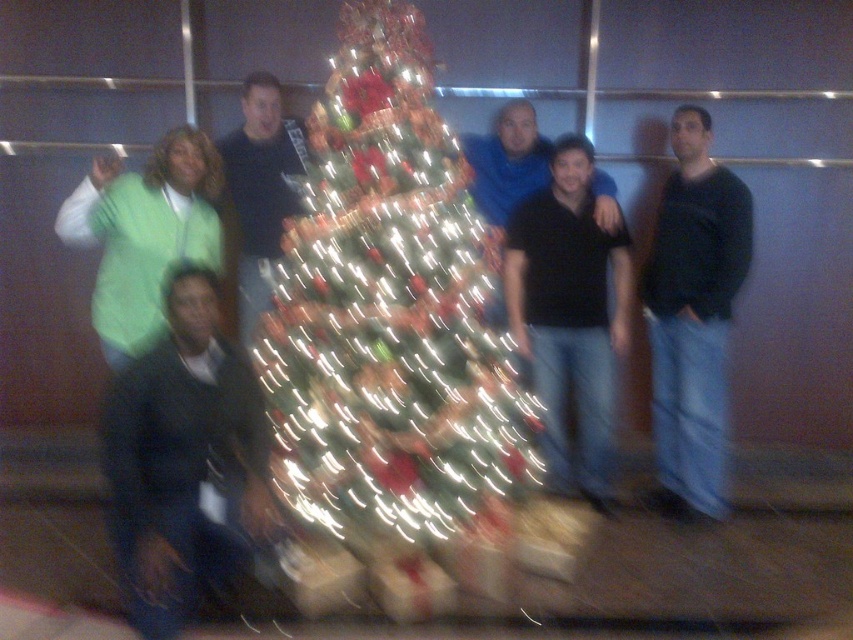
Question: Does dark blue jacket at lower left appear on the left side of green fleece at left?

Choices:
 (A) no
 (B) yes

Answer: (A)

Question: Which of the following is the closest to the observer?

Choices:
 (A) (366, 92)
 (B) (192, 193)

Answer: (A)

Question: Which object is farther from the camera taking this photo?

Choices:
 (A) black matte shirt at center
 (B) dark blue jacket at lower left

Answer: (A)

Question: Does green matte christmas tree at center appear under black matte shirt at right?

Choices:
 (A) no
 (B) yes

Answer: (A)

Question: Which object is positioned closest to the dark blue jacket at lower left?

Choices:
 (A) matte black shirt at center
 (B) black matte shirt at right

Answer: (A)

Question: Is black matte shirt at right below matte black shirt at center?

Choices:
 (A) yes
 (B) no

Answer: (A)